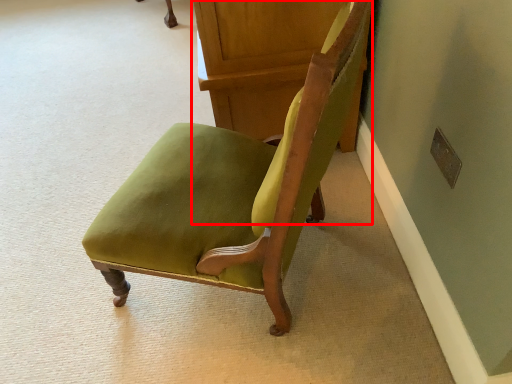
Question: From the image, what is the correct spatial relationship of furniture (annotated by the red box) in relation to chair?

Choices:
 (A) right
 (B) left

Answer: (A)